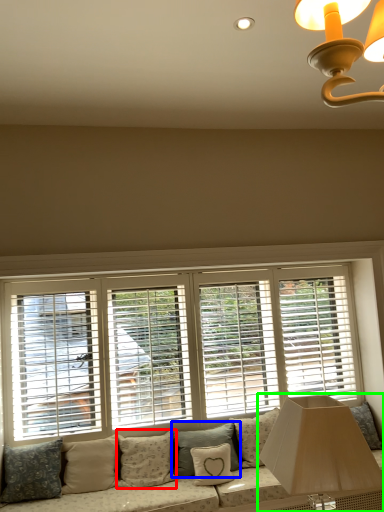
Question: Which object is the farthest from pillow (highlighted by a red box)? Choose among these: pillow (highlighted by a blue box) or table lamp (highlighted by a green box).

Choices:
 (A) pillow
 (B) table lamp

Answer: (B)